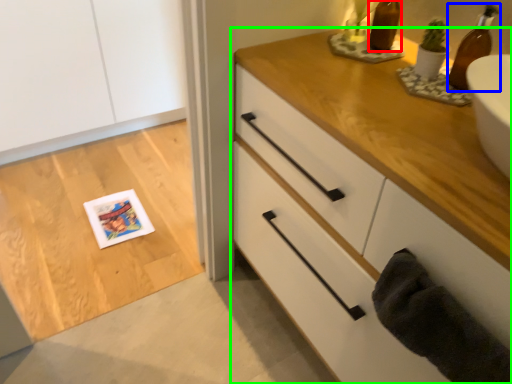
Question: Considering the real-world distances, which object is farthest from bottle (highlighted by a red box)? beer bottle (highlighted by a blue box) or chest of drawers (highlighted by a green box)?

Choices:
 (A) beer bottle
 (B) chest of drawers

Answer: (B)